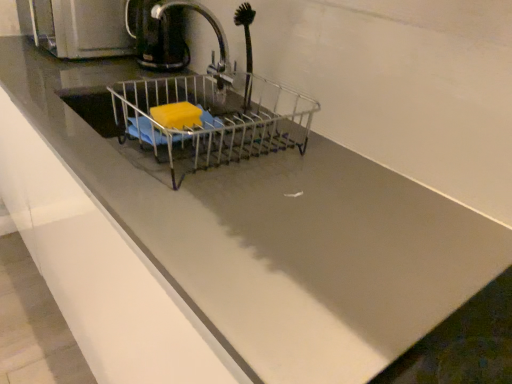
You are a GUI agent. You are given a task and a screenshot of the screen. Output one action in this format:
    pyautogui.click(x=<x>, y=<y>)
    Task: Click on the metallic faucet at center
    This screenshot has height=384, width=512.
    Given the screenshot: What is the action you would take?
    pyautogui.click(x=215, y=33)

Image resolution: width=512 pixels, height=384 pixels. Identify the location of metallic silver kettle at upper left. (82, 28).

Locate an element on the screen. metallic wire basket at center is located at coordinates (212, 121).

The height and width of the screenshot is (384, 512). Describe the element at coordinates (158, 37) in the screenshot. I see `black plastic coffee pot at upper left` at that location.

This screenshot has height=384, width=512. What do you see at coordinates (246, 47) in the screenshot? I see `black rubber brush at upper center` at bounding box center [246, 47].

This screenshot has height=384, width=512. I want to click on metallic faucet at center, so click(x=215, y=33).

How far apart are black plastic coffee pot at upper left and black rubber brush at upper center?

A distance of 13.28 inches exists between black plastic coffee pot at upper left and black rubber brush at upper center.

Does black plastic coffee pot at upper left appear on the right side of black rubber brush at upper center?

Incorrect, black plastic coffee pot at upper left is not on the right side of black rubber brush at upper center.

Is black plastic coffee pot at upper left smaller than black rubber brush at upper center?

Incorrect, black plastic coffee pot at upper left is not smaller in size than black rubber brush at upper center.

The height and width of the screenshot is (384, 512). In order to click on brush in front of the black plastic coffee pot at upper left in this screenshot , I will do `click(246, 47)`.

From the image's perspective, would you say metallic silver kettle at upper left is positioned over metallic faucet at center?

Yes, from the image's perspective, metallic silver kettle at upper left is above metallic faucet at center.

Consider the image. Is metallic silver kettle at upper left positioned behind metallic faucet at center?

Yes, it is behind metallic faucet at center.

Does metallic silver kettle at upper left have a greater height compared to metallic faucet at center?

Incorrect, the height of metallic silver kettle at upper left is not larger of that of metallic faucet at center.

In the image, there is a metallic faucet at center. Where is `appliance below it (from a real-world perspective)`? appliance below it (from a real-world perspective) is located at coordinates (82, 28).

From the image's perspective, which object appears higher, metallic faucet at center or black plastic coffee pot at upper left?

black plastic coffee pot at upper left, from the image's perspective.

Based on the photo, which object is positioned more to the right, metallic faucet at center or black plastic coffee pot at upper left?

metallic faucet at center is more to the right.

Which is more to the left, metallic wire basket at center or black plastic coffee pot at upper left?

Positioned to the left is black plastic coffee pot at upper left.

From the image's perspective, is metallic wire basket at center positioned above or below black plastic coffee pot at upper left?

Clearly, from the image's perspective, metallic wire basket at center is below black plastic coffee pot at upper left.

Is the position of metallic wire basket at center less distant than that of black plastic coffee pot at upper left?

Yes.

How much distance is there between metallic wire basket at center and black plastic coffee pot at upper left?

The distance of metallic wire basket at center from black plastic coffee pot at upper left is 32.97 centimeters.

Is black plastic coffee pot at upper left aimed at metallic wire basket at center?

No, black plastic coffee pot at upper left is not facing towards metallic wire basket at center.

Based on their sizes in the image, would you say black plastic coffee pot at upper left is bigger or smaller than metallic wire basket at center?

Clearly, black plastic coffee pot at upper left is smaller in size than metallic wire basket at center.

Considering the positions of objects black plastic coffee pot at upper left and metallic wire basket at center in the image provided, who is in front, black plastic coffee pot at upper left or metallic wire basket at center?

metallic wire basket at center is closer to the camera.

Looking at this image, considering the sizes of metallic wire basket at center and metallic silver kettle at upper left in the image, is metallic wire basket at center wider or thinner than metallic silver kettle at upper left?

metallic wire basket at center is thinner than metallic silver kettle at upper left.

Considering the relative sizes of metallic wire basket at center and metallic silver kettle at upper left in the image provided, is metallic wire basket at center bigger than metallic silver kettle at upper left?

No, metallic wire basket at center is not bigger than metallic silver kettle at upper left.

Is metallic wire basket at center positioned with its back to metallic silver kettle at upper left?

No.

Is metallic wire basket at center taller than metallic silver kettle at upper left?

No.

Considering the sizes of objects metallic faucet at center and metallic wire basket at center in the image provided, who is shorter, metallic faucet at center or metallic wire basket at center?

metallic wire basket at center is shorter.

From the picture: Is metallic faucet at center to the right of metallic wire basket at center from the viewer's perspective?

No.

The height and width of the screenshot is (384, 512). I want to click on coffeepot on the left of black rubber brush at upper center, so click(x=158, y=37).

The width and height of the screenshot is (512, 384). Identify the location of appliance behind the metallic faucet at center. (82, 28).

Considering their positions, is black rubber brush at upper center positioned further to metallic wire basket at center than metallic faucet at center?

metallic faucet at center lies further to metallic wire basket at center than the other object.

Estimate the real-world distances between objects in this image. Which object is further from metallic silver kettle at upper left, metallic faucet at center or metallic wire basket at center?

metallic wire basket at center is further to metallic silver kettle at upper left.

Based on their spatial positions, is black plastic coffee pot at upper left or metallic wire basket at center closer to metallic faucet at center?

Based on the image, black plastic coffee pot at upper left appears to be nearer to metallic faucet at center.

Considering their positions, is metallic faucet at center positioned further to metallic silver kettle at upper left than black rubber brush at upper center?

Based on the image, black rubber brush at upper center appears to be further to metallic silver kettle at upper left.

From the image, which object appears to be nearer to black rubber brush at upper center, metallic silver kettle at upper left or metallic faucet at center?

The object closer to black rubber brush at upper center is metallic faucet at center.

Considering their positions, is black plastic coffee pot at upper left positioned closer to metallic silver kettle at upper left than metallic faucet at center?

black plastic coffee pot at upper left is closer to metallic silver kettle at upper left.

Looking at the image, which one is located closer to metallic faucet at center, metallic silver kettle at upper left or metallic wire basket at center?

metallic silver kettle at upper left.

From the image, which object appears to be nearer to black plastic coffee pot at upper left, black rubber brush at upper center or metallic silver kettle at upper left?

Among the two, metallic silver kettle at upper left is located nearer to black plastic coffee pot at upper left.

This screenshot has height=384, width=512. Find the location of `tap between metallic silver kettle at upper left and black rubber brush at upper center from left to right`. tap between metallic silver kettle at upper left and black rubber brush at upper center from left to right is located at coordinates (215, 33).

At what (x,y) coordinates should I click in order to perform the action: click on shopping cart between metallic silver kettle at upper left and black rubber brush at upper center in the horizontal direction. Please return your answer as a coordinate pair (x, y). This screenshot has height=384, width=512. Looking at the image, I should click on (212, 121).

Where is `appliance positioned between metallic wire basket at center and black plastic coffee pot at upper left from near to far`? This screenshot has height=384, width=512. appliance positioned between metallic wire basket at center and black plastic coffee pot at upper left from near to far is located at coordinates (82, 28).

I want to click on tap between metallic wire basket at center and black rubber brush at upper center along the z-axis, so click(x=215, y=33).